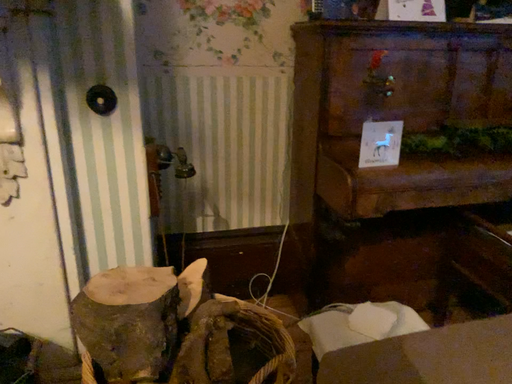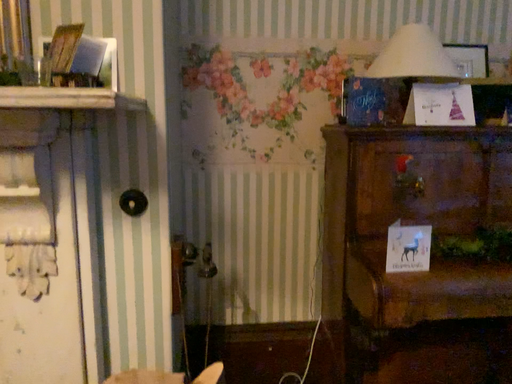
Question: Which way did the camera rotate in the video?

Choices:
 (A) rotated upward
 (B) rotated downward

Answer: (A)